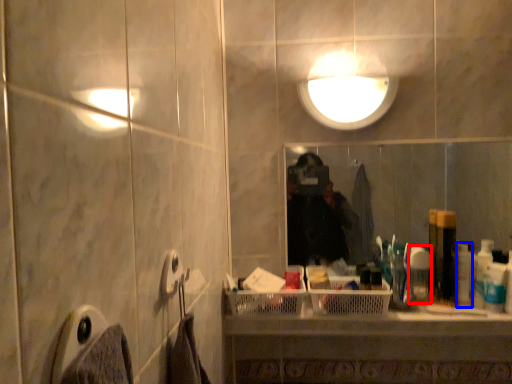
Question: Among these objects, which one is farthest to the camera, toiletry (highlighted by a red box) or toiletry (highlighted by a blue box)?

Choices:
 (A) toiletry
 (B) toiletry

Answer: (A)